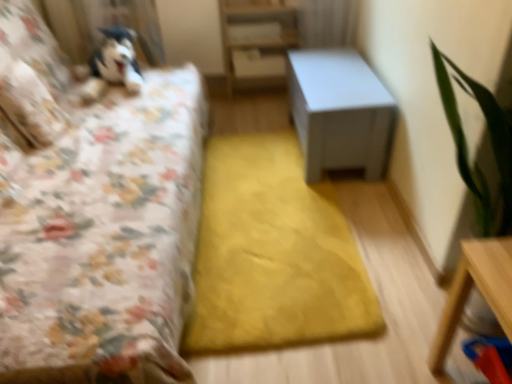
Question: From a real-world perspective, is fluffy white pillow at upper left, placed as the first pillow when sorted from top to bottom, below white matte table at center, placed as the first table when sorted from back to front?

Choices:
 (A) yes
 (B) no

Answer: (B)

Question: Is fluffy white pillow at upper left, placed as the first pillow when sorted from top to bottom, thinner than white matte table at center, the second table ordered from the bottom?

Choices:
 (A) yes
 (B) no

Answer: (A)

Question: Could you tell me if fluffy white pillow at upper left, which is the second pillow in right-to-left order, is turned towards white matte table at center, placed as the first table when sorted from back to front?

Choices:
 (A) yes
 (B) no

Answer: (A)

Question: Considering the relative sizes of fluffy white pillow at upper left, placed as the first pillow when sorted from top to bottom, and white matte table at center, the second table ordered from the bottom, in the image provided, is fluffy white pillow at upper left, placed as the first pillow when sorted from top to bottom, smaller than white matte table at center, the second table ordered from the bottom,?

Choices:
 (A) no
 (B) yes

Answer: (B)

Question: Does fluffy white pillow at upper left, the 1th pillow in the left-to-right sequence, have a larger size compared to white matte table at center, the second table ordered from the bottom?

Choices:
 (A) no
 (B) yes

Answer: (A)

Question: From a real-world perspective, is fluffy white pillow at upper left, which is the second pillow in right-to-left order, physically located above or below white matte table at center, placed as the first table when sorted from back to front?

Choices:
 (A) below
 (B) above

Answer: (B)

Question: Considering the positions of fluffy white pillow at upper left, the 1th pillow in the left-to-right sequence, and white matte table at center, placed as the first table when sorted from back to front, in the image, is fluffy white pillow at upper left, the 1th pillow in the left-to-right sequence, taller or shorter than white matte table at center, placed as the first table when sorted from back to front,?

Choices:
 (A) short
 (B) tall

Answer: (B)

Question: In the image, is fluffy white pillow at upper left, which is the second pillow in right-to-left order, on the left side or the right side of white matte table at center, positioned as the first table in top-to-bottom order?

Choices:
 (A) left
 (B) right

Answer: (A)

Question: Is point (33, 24) closer or farther from the camera than point (339, 114)?

Choices:
 (A) closer
 (B) farther

Answer: (B)

Question: From the image's perspective, is white matte bookshelf at center above or below white matte table at center, the 2th table from the front?

Choices:
 (A) below
 (B) above

Answer: (B)

Question: Considering the relative positions of white matte bookshelf at center and white matte table at center, placed as the first table when sorted from back to front, in the image provided, is white matte bookshelf at center to the left or to the right of white matte table at center, placed as the first table when sorted from back to front,?

Choices:
 (A) right
 (B) left

Answer: (B)

Question: Is white matte bookshelf at center in front of or behind white matte table at center, the 2th table from the front, in the image?

Choices:
 (A) front
 (B) behind

Answer: (B)

Question: Does point (292, 44) appear closer or farther from the camera than point (355, 72)?

Choices:
 (A) farther
 (B) closer

Answer: (A)

Question: Is white matte table at center, the second table ordered from the bottom, taller or shorter than floral fabric pillow at left, which ranks as the second pillow in back-to-front order?

Choices:
 (A) tall
 (B) short

Answer: (A)

Question: Does point (333, 150) appear closer or farther from the camera than point (24, 120)?

Choices:
 (A) closer
 (B) farther

Answer: (B)